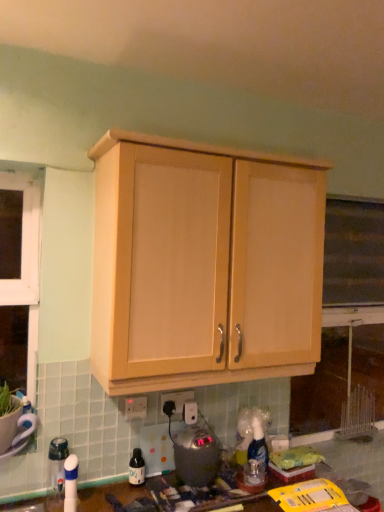
I want to click on light wood cabinet at upper center, so click(204, 264).

Describe the element at coordinates (177, 400) in the screenshot. I see `white plastic electric outlet at center, placed as the 2th electric outlet when sorted from left to right` at that location.

Identify the location of translucent plastic bottle at lower center. The width and height of the screenshot is (384, 512). (136, 468).

In the scene shown: From the image's perspective, which one is positioned lower, white plastic electric outlet at center, the 1th electric outlet when ordered from right to left, or satin silver appliance at lower center?

From the image's view, satin silver appliance at lower center is below.

Can you confirm if white plastic electric outlet at center, placed as the 2th electric outlet when sorted from front to back, is smaller than satin silver appliance at lower center?

Correct, white plastic electric outlet at center, placed as the 2th electric outlet when sorted from front to back, occupies less space than satin silver appliance at lower center.

From a real-world perspective, count 2nd electric outlets upward from the satin silver appliance at lower center and point to it. Please provide its 2D coordinates.

[(177, 400)]

In the image, is white plastic electric outlet at center, the 1th electric outlet from the back, positioned in front of or behind satin silver appliance at lower center?

Clearly, white plastic electric outlet at center, the 1th electric outlet from the back, is behind satin silver appliance at lower center.

Is translucent plastic bottle at lower center aimed at white plastic electric outlet at lower center, which appears as the first electric outlet when viewed from the front?

No, translucent plastic bottle at lower center is not facing towards white plastic electric outlet at lower center, which appears as the first electric outlet when viewed from the front.

Is translucent plastic bottle at lower center completely or partially outside of white plastic electric outlet at lower center, which appears as the first electric outlet when viewed from the front?

Yes, translucent plastic bottle at lower center is not within white plastic electric outlet at lower center, which appears as the first electric outlet when viewed from the front.

What's the angular difference between translucent plastic bottle at lower center and white plastic electric outlet at lower center, arranged as the first electric outlet when viewed from the left,'s facing directions?

0.0141 degrees.

Who is more distant, translucent plastic bottle at lower center or white plastic electric outlet at lower center, the second electric outlet viewed from the right?

white plastic electric outlet at lower center, the second electric outlet viewed from the right, is further away from the camera.

From a real-world perspective, is light wood cabinet at upper center physically located above or below translucent plastic bottle at lower center?

Clearly, from a real-world perspective, light wood cabinet at upper center is above translucent plastic bottle at lower center.

Can you confirm if light wood cabinet at upper center is bigger than translucent plastic bottle at lower center?

Yes, light wood cabinet at upper center is bigger than translucent plastic bottle at lower center.

Image resolution: width=384 pixels, height=512 pixels. Find the location of `cabinetry above the translucent plastic bottle at lower center (from the image's perspective)`. cabinetry above the translucent plastic bottle at lower center (from the image's perspective) is located at coordinates point(204,264).

From the image's perspective, which one is positioned lower, light wood cabinet at upper center or translucent plastic bottle at lower center?

translucent plastic bottle at lower center, from the image's perspective.

From the picture: Which is closer, (227, 376) or (201, 443)?

Clearly, point (227, 376) is closer to the camera than point (201, 443).

Looking at this image, between light wood cabinet at upper center and satin silver appliance at lower center, which one is positioned in front?

Positioned in front is light wood cabinet at upper center.

From the image's perspective, between light wood cabinet at upper center and satin silver appliance at lower center, who is located below?

satin silver appliance at lower center, from the image's perspective.

Is light wood cabinet at upper center positioned with its back to satin silver appliance at lower center?

That's not correct — light wood cabinet at upper center is not looking away from satin silver appliance at lower center.

Considering the positions of point (176, 396) and point (195, 284), is point (176, 396) closer or farther from the camera than point (195, 284)?

Point (176, 396) appears to be farther away from the viewer than point (195, 284).

Which is more to the right, white plastic electric outlet at center, placed as the 2th electric outlet when sorted from left to right, or light wood cabinet at upper center?

light wood cabinet at upper center.

Which object is thinner, white plastic electric outlet at center, the 1th electric outlet from the back, or light wood cabinet at upper center?

Thinner between the two is white plastic electric outlet at center, the 1th electric outlet from the back.

Is white plastic electric outlet at center, placed as the 2th electric outlet when sorted from left to right, aimed at light wood cabinet at upper center?

No, white plastic electric outlet at center, placed as the 2th electric outlet when sorted from left to right, does not turn towards light wood cabinet at upper center.

Is white plastic electric outlet at center, the 1th electric outlet from the back, inside or outside of white plastic electric outlet at lower center, the second electric outlet viewed from the right?

white plastic electric outlet at center, the 1th electric outlet from the back, is not inside white plastic electric outlet at lower center, the second electric outlet viewed from the right, it's outside.

Is point (162, 394) positioned behind point (140, 405)?

Yes.

Considering the relative sizes of white plastic electric outlet at center, placed as the 2th electric outlet when sorted from front to back, and white plastic electric outlet at lower center, the second electric outlet viewed from the right, in the image provided, is white plastic electric outlet at center, placed as the 2th electric outlet when sorted from front to back, thinner than white plastic electric outlet at lower center, the second electric outlet viewed from the right,?

Incorrect, the width of white plastic electric outlet at center, placed as the 2th electric outlet when sorted from front to back, is not less than that of white plastic electric outlet at lower center, the second electric outlet viewed from the right.

Is translucent plastic bottle at lower center completely or partially inside white plastic electric outlet at center, the 1th electric outlet when ordered from right to left?

No, translucent plastic bottle at lower center is not surrounded by white plastic electric outlet at center, the 1th electric outlet when ordered from right to left.

Considering the positions of objects white plastic electric outlet at center, the 1th electric outlet from the back, and translucent plastic bottle at lower center in the image provided, who is more to the right, white plastic electric outlet at center, the 1th electric outlet from the back, or translucent plastic bottle at lower center?

Positioned to the right is white plastic electric outlet at center, the 1th electric outlet from the back.

Are white plastic electric outlet at center, placed as the 2th electric outlet when sorted from left to right, and translucent plastic bottle at lower center making contact?

white plastic electric outlet at center, placed as the 2th electric outlet when sorted from left to right, is not next to translucent plastic bottle at lower center, and they're not touching.

This screenshot has width=384, height=512. In order to click on appliance that is in front of the white plastic electric outlet at center, placed as the 2th electric outlet when sorted from front to back in this screenshot , I will do `click(195, 452)`.

Image resolution: width=384 pixels, height=512 pixels. I want to click on the 2nd electric outlet above when counting from the translucent plastic bottle at lower center (from the image's perspective), so click(x=135, y=407).

Based on their spatial positions, is translucent plastic bottle at lower center or white plastic electric outlet at center, the 1th electric outlet when ordered from right to left, closer to satin silver appliance at lower center?

white plastic electric outlet at center, the 1th electric outlet when ordered from right to left, is positioned closer to the anchor satin silver appliance at lower center.

Looking at the image, which one is located closer to translucent plastic bottle at lower center, satin silver appliance at lower center or light wood cabinet at upper center?

The object closer to translucent plastic bottle at lower center is satin silver appliance at lower center.

From the image, which object appears to be nearer to translucent plastic bottle at lower center, satin silver appliance at lower center or white plastic electric outlet at center, the 1th electric outlet when ordered from right to left?

satin silver appliance at lower center is closer to translucent plastic bottle at lower center.

From the image, which object appears to be farther from white plastic electric outlet at lower center, arranged as the first electric outlet when viewed from the left, satin silver appliance at lower center or translucent plastic bottle at lower center?

satin silver appliance at lower center lies further to white plastic electric outlet at lower center, arranged as the first electric outlet when viewed from the left, than the other object.

Which object lies nearer to the anchor point translucent plastic bottle at lower center, light wood cabinet at upper center or white plastic electric outlet at lower center, arranged as the first electric outlet when viewed from the left?

white plastic electric outlet at lower center, arranged as the first electric outlet when viewed from the left.

From the image, which object appears to be nearer to translucent plastic bottle at lower center, white plastic electric outlet at lower center, arranged as the first electric outlet when viewed from the left, or satin silver appliance at lower center?

Based on the image, white plastic electric outlet at lower center, arranged as the first electric outlet when viewed from the left, appears to be nearer to translucent plastic bottle at lower center.

Estimate the real-world distances between objects in this image. Which object is further from satin silver appliance at lower center, light wood cabinet at upper center or white plastic electric outlet at center, placed as the 2th electric outlet when sorted from front to back?

The object further to satin silver appliance at lower center is light wood cabinet at upper center.

Estimate the real-world distances between objects in this image. Which object is closer to white plastic electric outlet at center, placed as the 2th electric outlet when sorted from left to right, satin silver appliance at lower center or translucent plastic bottle at lower center?

satin silver appliance at lower center.

Where is `appliance between light wood cabinet at upper center and translucent plastic bottle at lower center in the up-down direction`? appliance between light wood cabinet at upper center and translucent plastic bottle at lower center in the up-down direction is located at coordinates 195,452.

I want to click on electric outlet between translucent plastic bottle at lower center and satin silver appliance at lower center from left to right, so click(177, 400).

This screenshot has height=512, width=384. Identify the location of electric outlet that lies between light wood cabinet at upper center and white plastic electric outlet at center, placed as the 2th electric outlet when sorted from front to back, from top to bottom. (135, 407).

Identify the location of bottle between white plastic electric outlet at lower center, which is the second electric outlet from back to front, and satin silver appliance at lower center from left to right. (136, 468).